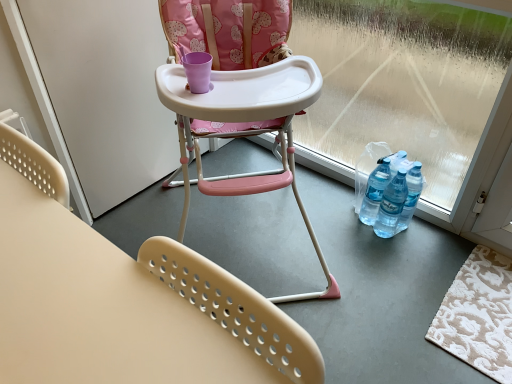
Question: Is pink plastic highchair at center, the 2th chair when ordered from front to back, completely or partially inside transparent plastic window screen at lower right?

Choices:
 (A) no
 (B) yes

Answer: (A)

Question: From a real-world perspective, is transparent plastic window screen at lower right located higher than pink plastic highchair at center, the 1th chair from the back?

Choices:
 (A) no
 (B) yes

Answer: (A)

Question: Is transparent plastic window screen at lower right facing towards pink plastic highchair at center, the 2th chair when ordered from front to back?

Choices:
 (A) yes
 (B) no

Answer: (A)

Question: From the image's perspective, is transparent plastic window screen at lower right on pink plastic highchair at center, the 2th chair when ordered from front to back?

Choices:
 (A) no
 (B) yes

Answer: (B)

Question: From the image's perspective, is transparent plastic window screen at lower right under pink plastic highchair at center, the 2th chair when ordered from front to back?

Choices:
 (A) yes
 (B) no

Answer: (B)

Question: Is transparent plastic window screen at lower right positioned in front of pink plastic highchair at center, the 1th chair from the back?

Choices:
 (A) no
 (B) yes

Answer: (A)

Question: Is white matte screen door at left in contact with pink plastic highchair at center, the 1th chair from the back?

Choices:
 (A) yes
 (B) no

Answer: (B)

Question: Does white matte screen door at left have a greater width compared to pink plastic highchair at center, the 2th chair when ordered from front to back?

Choices:
 (A) yes
 (B) no

Answer: (B)

Question: From the image's perspective, would you say white matte screen door at left is positioned over pink plastic highchair at center, the 1th chair from the back?

Choices:
 (A) yes
 (B) no

Answer: (A)

Question: Is white matte screen door at left to the right of pink plastic highchair at center, the 2th chair when ordered from front to back, from the viewer's perspective?

Choices:
 (A) no
 (B) yes

Answer: (A)

Question: From a real-world perspective, does white matte screen door at left stand above pink plastic highchair at center, the 1th chair from the back?

Choices:
 (A) yes
 (B) no

Answer: (B)

Question: Is white matte screen door at left smaller than pink plastic highchair at center, the 2th chair when ordered from front to back?

Choices:
 (A) yes
 (B) no

Answer: (A)

Question: Does transparent plastic window screen at lower right lie in front of white matte screen door at left?

Choices:
 (A) no
 (B) yes

Answer: (B)